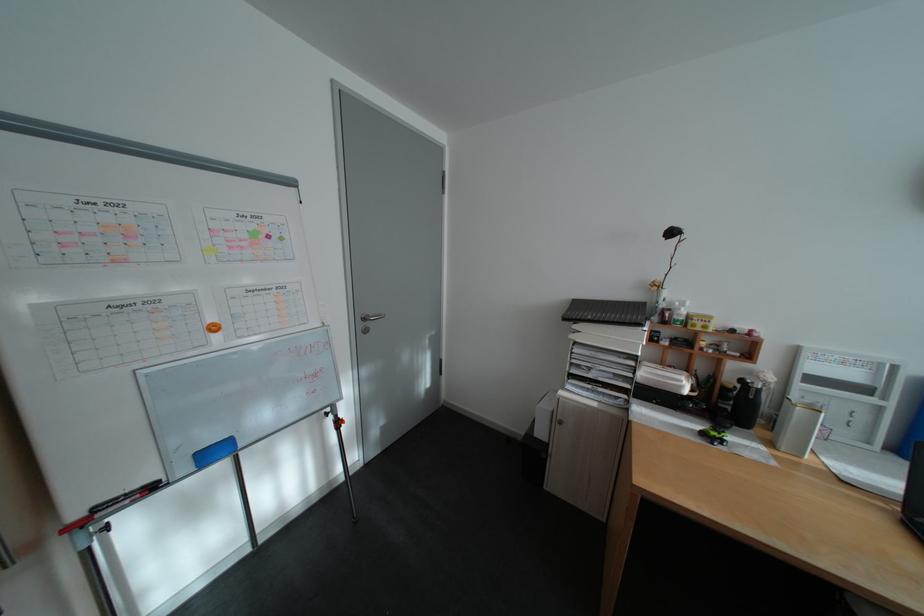
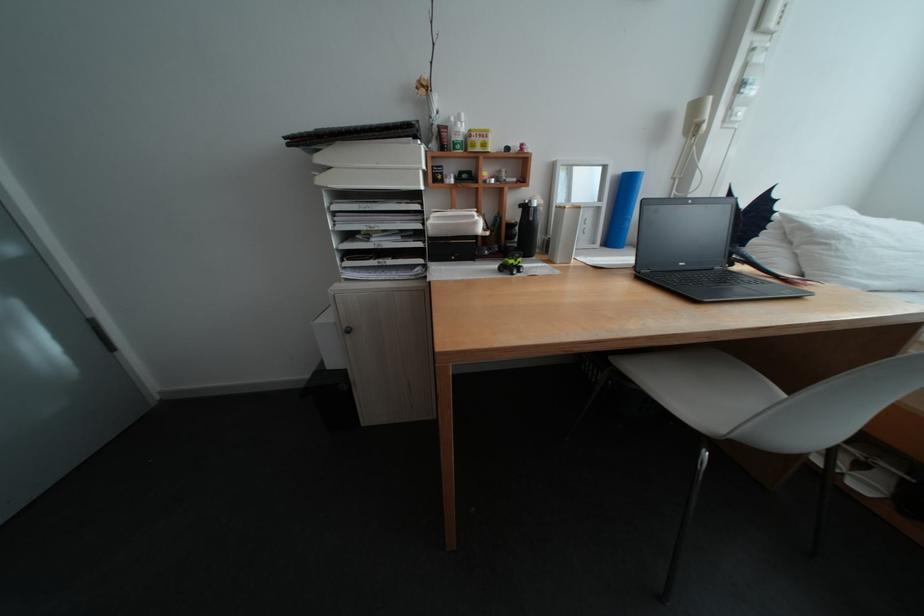
Where in the second image is the point corresponding to (x=708, y=320) from the first image?

(485, 135)